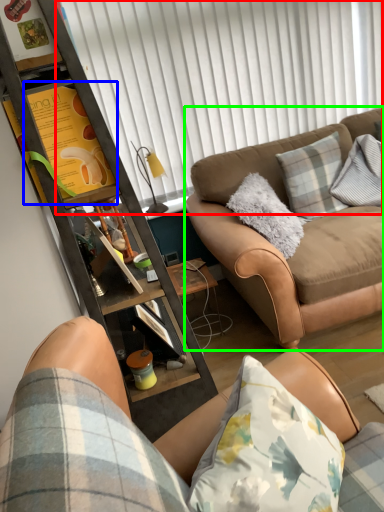
Question: Considering the real-world distances, which object is farthest from shutter (highlighted by a red box)? bulletin board (highlighted by a blue box) or studio couch (highlighted by a green box)?

Choices:
 (A) bulletin board
 (B) studio couch

Answer: (A)